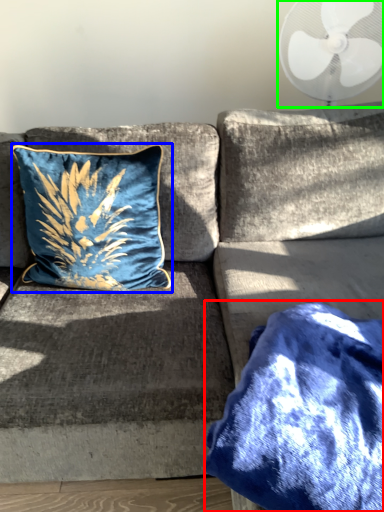
Question: Considering the real-world distances, which object is farthest from blanket (highlighted by a red box)? pillow (highlighted by a blue box) or mechanical fan (highlighted by a green box)?

Choices:
 (A) pillow
 (B) mechanical fan

Answer: (B)